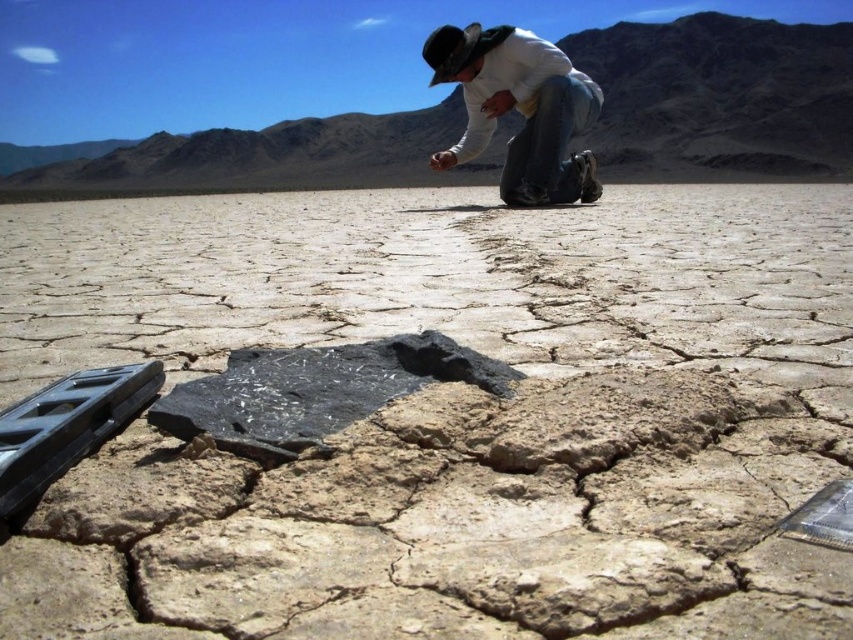
Is black matte rock at center closer to camera compared to denim jeans at center?

Yes.

Who is higher up, black matte rock at center or denim jeans at center?

Positioned higher is denim jeans at center.

Image resolution: width=853 pixels, height=640 pixels. What do you see at coordinates (315, 390) in the screenshot?
I see `black matte rock at center` at bounding box center [315, 390].

The height and width of the screenshot is (640, 853). What are the coordinates of `black matte rock at center` in the screenshot? It's located at (315, 390).